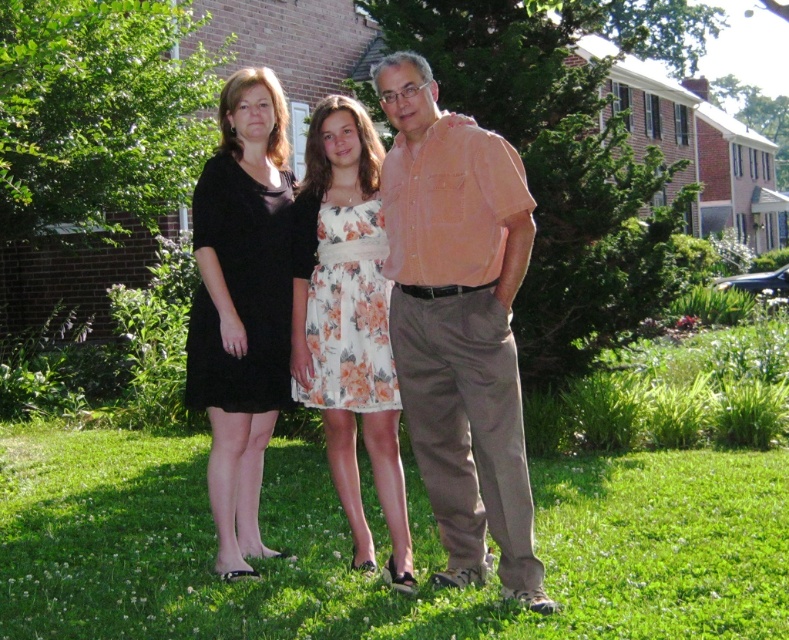
Question: Which point is farther to the camera?

Choices:
 (A) (328, 422)
 (B) (492, 618)

Answer: (A)

Question: Is green grass at center thinner than floral dress at center?

Choices:
 (A) no
 (B) yes

Answer: (A)

Question: Which object is farther from the camera taking this photo?

Choices:
 (A) black matte dress at center
 (B) floral dress at center
 (C) light orange cotton shirt at center
 (D) green grass at center

Answer: (D)

Question: Does light orange cotton shirt at center have a larger size compared to black matte dress at center?

Choices:
 (A) no
 (B) yes

Answer: (B)

Question: Estimate the real-world distances between objects in this image. Which object is farther from the light orange cotton shirt at center?

Choices:
 (A) green grass at center
 (B) black matte dress at center

Answer: (A)

Question: Can you confirm if green grass at center is positioned to the right of floral dress at center?

Choices:
 (A) no
 (B) yes

Answer: (B)